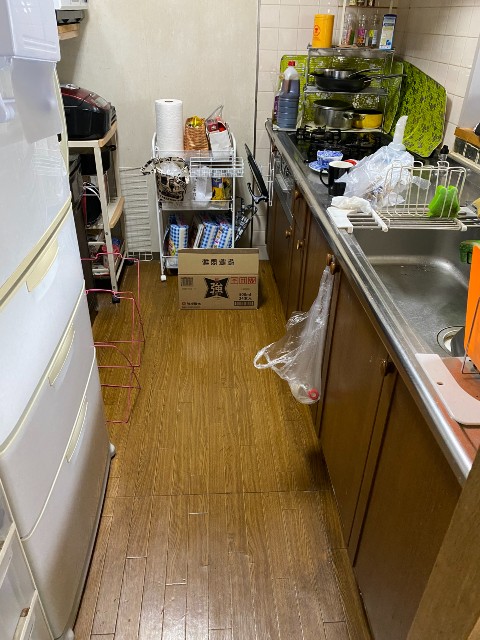
Where is `sink rack`? This screenshot has height=640, width=480. sink rack is located at coordinates (406, 219).